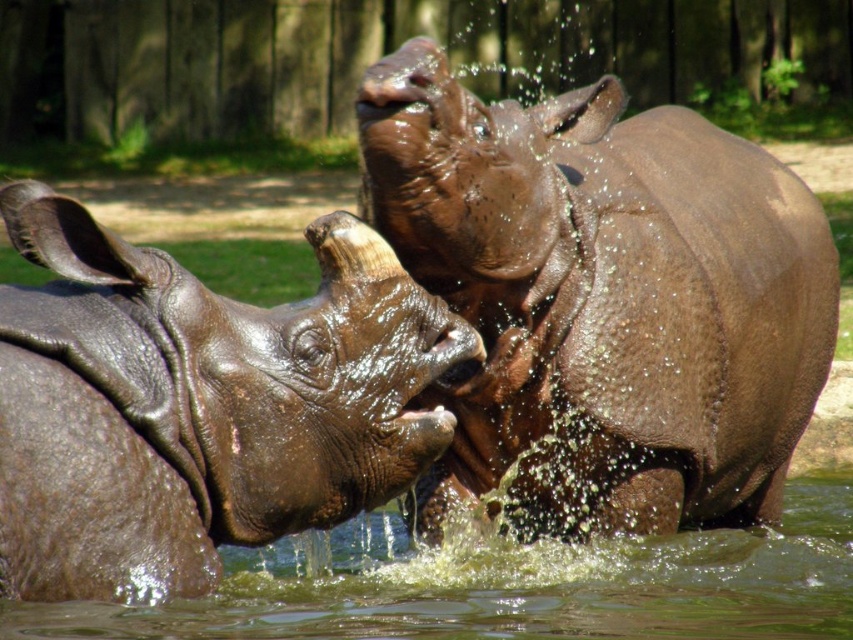
Between point (461, 304) and point (277, 564), which one is positioned in front?

Positioned in front is point (461, 304).

Is wet brown rhinoceros at center positioned before clear water at rhino center?

No.

Between point (741, 160) and point (387, 529), which one is positioned in front?

Point (387, 529)

At what (x,y) coordinates should I click in order to perform the action: click on wet brown rhinoceros at center. Please return your answer as a coordinate pair (x, y). Looking at the image, I should click on (604, 296).

This screenshot has width=853, height=640. What do you see at coordinates (604, 296) in the screenshot?
I see `wet brown rhinoceros at center` at bounding box center [604, 296].

Can you confirm if wet brown rhinoceros at center is positioned above glossy brown rhinoceros at center?

Yes.

You are a GUI agent. You are given a task and a screenshot of the screen. Output one action in this format:
    pyautogui.click(x=<x>, y=<y>)
    Task: Click on the wet brown rhinoceros at center
    This screenshot has height=640, width=853.
    Given the screenshot: What is the action you would take?
    pyautogui.click(x=604, y=296)

Identify the location of wet brown rhinoceros at center. The image size is (853, 640). (604, 296).

Does glossy brown rhinoceros at center appear on the right side of clear water at rhino center?

In fact, glossy brown rhinoceros at center is to the left of clear water at rhino center.

Who is taller, glossy brown rhinoceros at center or clear water at rhino center?

glossy brown rhinoceros at center

The height and width of the screenshot is (640, 853). In order to click on glossy brown rhinoceros at center in this screenshot , I will do 198,403.

This screenshot has height=640, width=853. Identify the location of glossy brown rhinoceros at center. (198, 403).